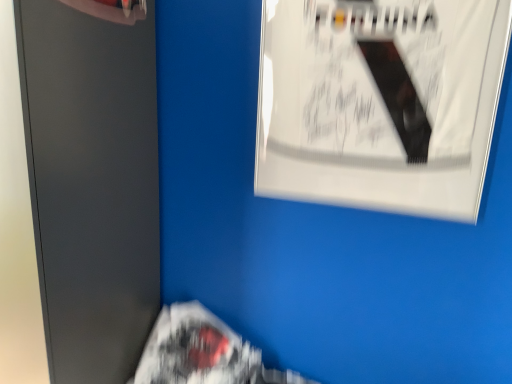
Find the location of `white paper flyer at lower center`. white paper flyer at lower center is located at coordinates (203, 352).

Describe the element at coordinates (380, 103) in the screenshot. I see `white glossy poster at upper right` at that location.

Where is `matte gray file cabinet at left`? The width and height of the screenshot is (512, 384). matte gray file cabinet at left is located at coordinates (92, 184).

In terms of width, does white glossy poster at upper right look wider or thinner when compared to white paper flyer at lower center?

Clearly, white glossy poster at upper right has less width compared to white paper flyer at lower center.

Is white glossy poster at upper right bigger or smaller than white paper flyer at lower center?

In the image, white glossy poster at upper right appears to be smaller than white paper flyer at lower center.

What's the angular difference between white glossy poster at upper right and white paper flyer at lower center's facing directions?

0.284 degrees.

Is matte gray file cabinet at left aimed at white glossy poster at upper right?

No, matte gray file cabinet at left is not turned towards white glossy poster at upper right.

I want to click on file cabinet that appears in front of the white glossy poster at upper right, so point(92,184).

Would you say matte gray file cabinet at left is to the left or to the right of white glossy poster at upper right in the picture?

Based on their positions, matte gray file cabinet at left is located to the left of white glossy poster at upper right.

Is matte gray file cabinet at left behind white glossy poster at upper right?

No, matte gray file cabinet at left is closer to the camera.

Is white paper flyer at lower center at the back of matte gray file cabinet at left?

No.

Are matte gray file cabinet at left and white paper flyer at lower center far apart?

No, matte gray file cabinet at left is not far from white paper flyer at lower center.

From the image's perspective, is matte gray file cabinet at left above or below white paper flyer at lower center?

matte gray file cabinet at left is situated higher than white paper flyer at lower center in the image.

Locate an element on the screen. The height and width of the screenshot is (384, 512). flyer below the matte gray file cabinet at left (from the image's perspective) is located at coordinates (203, 352).

Is white paper flyer at lower center far from white glossy poster at upper right?

white paper flyer at lower center is actually quite close to white glossy poster at upper right.

How distant is white paper flyer at lower center from white glossy poster at upper right?

The distance of white paper flyer at lower center from white glossy poster at upper right is 30.09 inches.

Which object is positioned more to the right, white paper flyer at lower center or white glossy poster at upper right?

From the viewer's perspective, white glossy poster at upper right appears more on the right side.

Based on the photo, is white glossy poster at upper right surrounded by white paper flyer at lower center?

Definitely not — white glossy poster at upper right is not inside white paper flyer at lower center.

From a real-world perspective, who is located lower, white paper flyer at lower center or matte gray file cabinet at left?

white paper flyer at lower center.

How far apart are white paper flyer at lower center and matte gray file cabinet at left?

15.62 inches.

Considering the positions of objects white paper flyer at lower center and matte gray file cabinet at left in the image provided, who is behind, white paper flyer at lower center or matte gray file cabinet at left?

white paper flyer at lower center.

Is white paper flyer at lower center outside of matte gray file cabinet at left?

white paper flyer at lower center lies outside matte gray file cabinet at left's area.

Who is shorter, white glossy poster at upper right or matte gray file cabinet at left?

white glossy poster at upper right.

Does white glossy poster at upper right have a smaller size compared to matte gray file cabinet at left?

Indeed, white glossy poster at upper right has a smaller size compared to matte gray file cabinet at left.

Is white glossy poster at upper right in contact with matte gray file cabinet at left?

They are not placed beside each other.

Is point (423, 47) positioned in front of point (128, 319)?

That is True.

You are a GUI agent. You are given a task and a screenshot of the screen. Output one action in this format:
    pyautogui.click(x=<x>, y=<y>)
    Task: Click on the poster on the right of white paper flyer at lower center
    This screenshot has height=384, width=512.
    Given the screenshot: What is the action you would take?
    pyautogui.click(x=380, y=103)

The height and width of the screenshot is (384, 512). Identify the location of poster that appears above the matte gray file cabinet at left (from a real-world perspective). (380, 103).

Considering their positions, is white glossy poster at upper right positioned further to white paper flyer at lower center than matte gray file cabinet at left?

white glossy poster at upper right is further to white paper flyer at lower center.

Estimate the real-world distances between objects in this image. Which object is closer to white paper flyer at lower center, matte gray file cabinet at left or white glossy poster at upper right?

matte gray file cabinet at left is closer to white paper flyer at lower center.

Based on their spatial positions, is white paper flyer at lower center or matte gray file cabinet at left closer to white glossy poster at upper right?

matte gray file cabinet at left is positioned closer to the anchor white glossy poster at upper right.

Which object lies nearer to the anchor point white glossy poster at upper right, matte gray file cabinet at left or white paper flyer at lower center?

matte gray file cabinet at left is closer to white glossy poster at upper right.

Estimate the real-world distances between objects in this image. Which object is closer to matte gray file cabinet at left, white paper flyer at lower center or white glossy poster at upper right?

white paper flyer at lower center is positioned closer to the anchor matte gray file cabinet at left.

Based on the photo, from the image, which object appears to be nearer to matte gray file cabinet at left, white glossy poster at upper right or white paper flyer at lower center?

The object closer to matte gray file cabinet at left is white paper flyer at lower center.

Locate an element on the screen. flyer between matte gray file cabinet at left and white glossy poster at upper right from left to right is located at coordinates (203, 352).